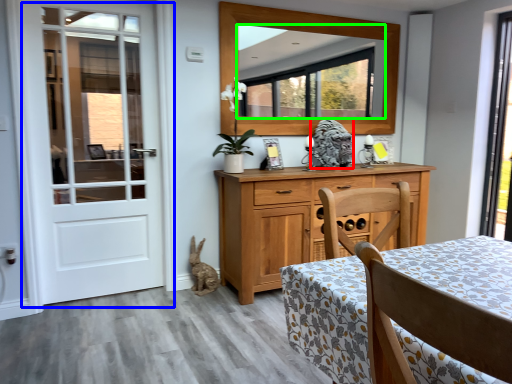
Question: Which is farther away from animal (highlighted by a red box)? door (highlighted by a blue box) or mirror (highlighted by a green box)?

Choices:
 (A) door
 (B) mirror

Answer: (A)